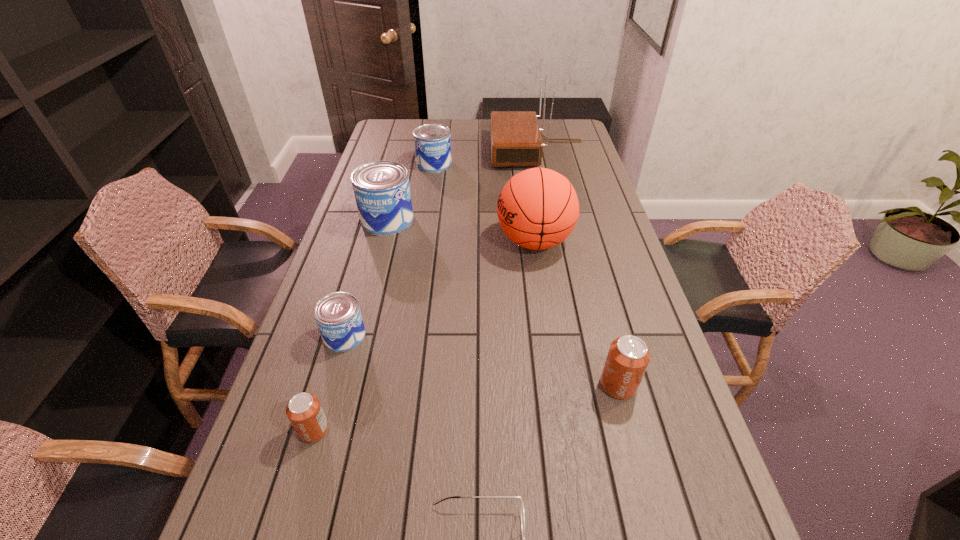
Locate an element on the screen. the smallest blue can is located at coordinates (338, 317).

Identify the location of the third nearest can. This screenshot has height=540, width=960. (338, 317).

Where is `vacant space located on the front panel of the radio_receiver`? vacant space located on the front panel of the radio_receiver is located at coordinates (432, 150).

This screenshot has height=540, width=960. I want to click on free space located on the front panel of the radio_receiver, so click(x=437, y=150).

In order to click on free location located on the front panel of the radio_receiver in this screenshot , I will do `click(468, 150)`.

The height and width of the screenshot is (540, 960). What are the coordinates of `vacant region located on the side with logo of the second tallest object` in the screenshot? It's located at (425, 241).

Find the location of a particular element. The height and width of the screenshot is (540, 960). free space located on the side with logo of the second tallest object is located at coordinates pyautogui.click(x=372, y=241).

This screenshot has width=960, height=540. I want to click on vacant space located on the side with logo of the second tallest object, so point(449,241).

The height and width of the screenshot is (540, 960). In order to click on vacant space located on the front label of the tallest can in this screenshot , I will do `click(498, 220)`.

The width and height of the screenshot is (960, 540). Identify the location of vacant region located on the back of the third nearest object. (592, 286).